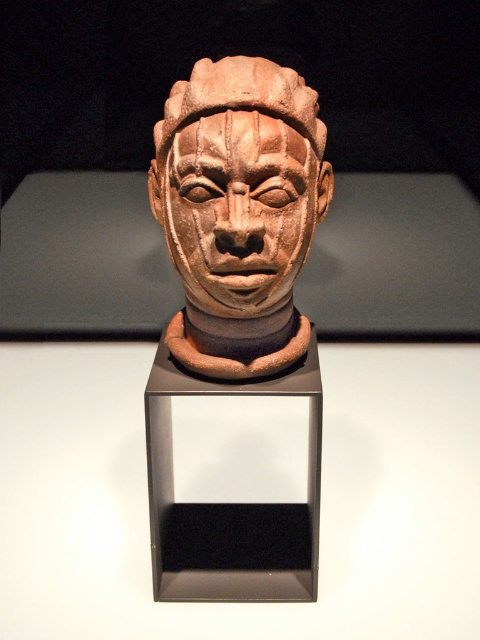
Is terracotta statue at center in front of matte clay head at center?

No, terracotta statue at center is behind matte clay head at center.

Who is higher up, terracotta statue at center or matte clay head at center?

Positioned higher is matte clay head at center.

Between point (207, 100) and point (213, 161), which one is positioned behind?

The point (207, 100) is behind.

Identify the location of terracotta statue at center. (239, 211).